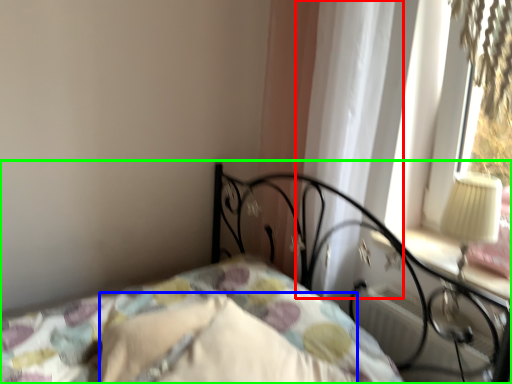
Question: Which is farther away from curtain (highlighted by a red box)? pillow (highlighted by a blue box) or bed (highlighted by a green box)?

Choices:
 (A) pillow
 (B) bed

Answer: (A)